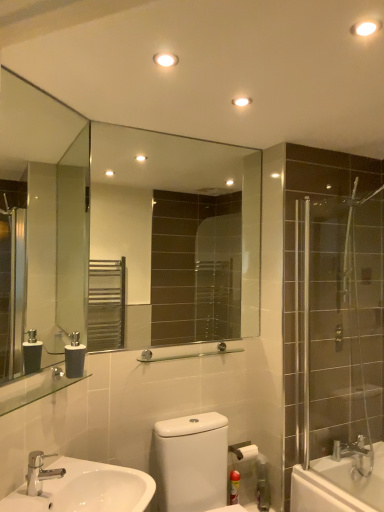
Question: Is white glossy sink at lower left outside of matte plastic canister at lower right?

Choices:
 (A) yes
 (B) no

Answer: (A)

Question: Is white glossy sink at lower left positioned with its back to matte plastic canister at lower right?

Choices:
 (A) yes
 (B) no

Answer: (B)

Question: From the image's perspective, is white glossy sink at lower left on matte plastic canister at lower right?

Choices:
 (A) no
 (B) yes

Answer: (B)

Question: Is white glossy sink at lower left far from matte plastic canister at lower right?

Choices:
 (A) yes
 (B) no

Answer: (B)

Question: Does white glossy sink at lower left come behind matte plastic canister at lower right?

Choices:
 (A) yes
 (B) no

Answer: (B)

Question: Do you think matte gray soap dispenser at lower left is within white glossy toilet at lower center, or outside of it?

Choices:
 (A) outside
 (B) inside

Answer: (A)

Question: Is matte gray soap dispenser at lower left wider or thinner than white glossy toilet at lower center?

Choices:
 (A) thin
 (B) wide

Answer: (A)

Question: From the image's perspective, is matte gray soap dispenser at lower left located above or below white glossy toilet at lower center?

Choices:
 (A) above
 (B) below

Answer: (A)

Question: Based on their positions, is matte gray soap dispenser at lower left located to the left or right of white glossy toilet at lower center?

Choices:
 (A) left
 (B) right

Answer: (A)

Question: From a real-world perspective, is clear glass mirror at upper left, acting as the second mirror starting from the right, physically located above or below clear glass shelf at lower left, positioned as the first balustrade in left-to-right order?

Choices:
 (A) below
 (B) above

Answer: (B)

Question: Considering the positions of clear glass mirror at upper left, acting as the second mirror starting from the right, and clear glass shelf at lower left, acting as the 1th balustrade starting from the front, in the image, is clear glass mirror at upper left, acting as the second mirror starting from the right, taller or shorter than clear glass shelf at lower left, acting as the 1th balustrade starting from the front,?

Choices:
 (A) short
 (B) tall

Answer: (B)

Question: Visually, is clear glass mirror at upper left, placed as the first mirror when sorted from front to back, positioned to the left or to the right of clear glass shelf at lower left, positioned as the first balustrade in left-to-right order?

Choices:
 (A) left
 (B) right

Answer: (A)

Question: Do you think clear glass mirror at upper left, arranged as the 1th mirror when viewed from the left, is within clear glass shelf at lower left, which ranks as the second balustrade in back-to-front order, or outside of it?

Choices:
 (A) inside
 (B) outside

Answer: (B)

Question: From the image's perspective, is chrome metallic faucet at lower left positioned above or below matte gray soap dispenser at lower left?

Choices:
 (A) below
 (B) above

Answer: (A)

Question: Is chrome metallic faucet at lower left taller or shorter than matte gray soap dispenser at lower left?

Choices:
 (A) tall
 (B) short

Answer: (B)